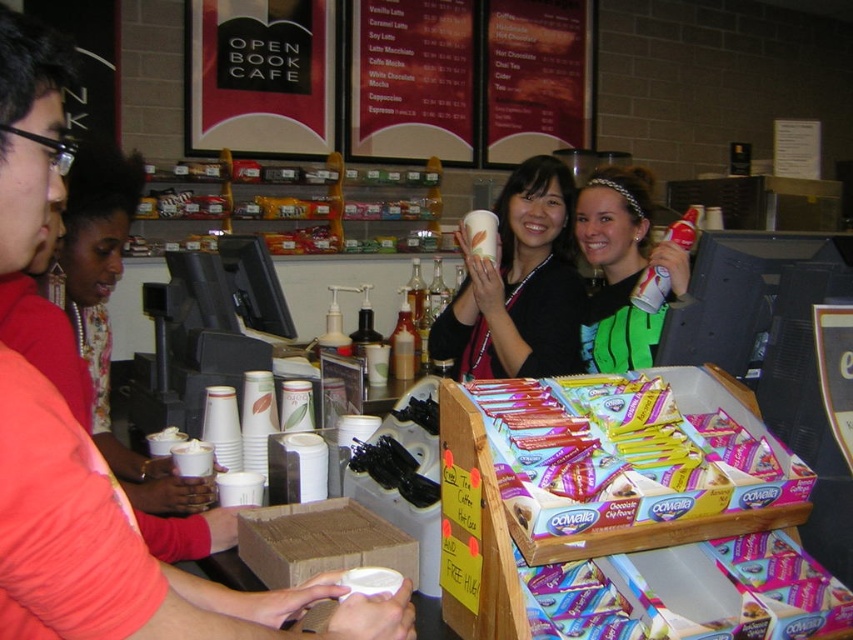
Can you confirm if matte white cup at center is positioned below green fabric shirt at center?

Actually, matte white cup at center is above green fabric shirt at center.

What are the coordinates of `matte white cup at center` in the screenshot? It's located at (519, 285).

Is point (480, 272) positioned after point (613, 269)?

No, it is not.

Where is `matte white cup at center`? The width and height of the screenshot is (853, 640). matte white cup at center is located at coordinates (519, 285).